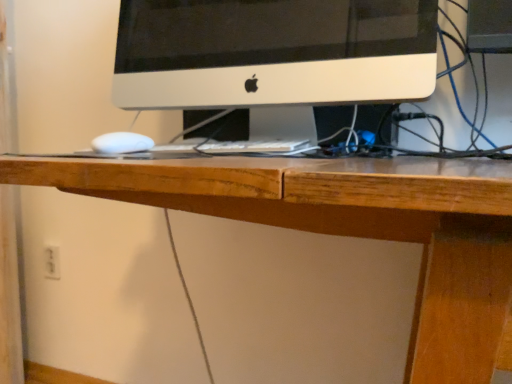
The width and height of the screenshot is (512, 384). In order to click on white plastic electric outlet at lower left in this screenshot , I will do `click(51, 262)`.

Describe the element at coordinates (51, 262) in the screenshot. The width and height of the screenshot is (512, 384). I see `white plastic electric outlet at lower left` at that location.

What are the coordinates of `white matte computer monitor at center` in the screenshot? It's located at (273, 53).

This screenshot has width=512, height=384. What do you see at coordinates (273, 53) in the screenshot?
I see `white matte computer monitor at center` at bounding box center [273, 53].

Identify the location of white plastic electric outlet at lower left. The width and height of the screenshot is (512, 384). point(51,262).

Does white plastic electric outlet at lower left appear on the right side of white matte computer monitor at center?

In fact, white plastic electric outlet at lower left is to the left of white matte computer monitor at center.

Which object is more forward, white plastic electric outlet at lower left or white matte computer monitor at center?

white matte computer monitor at center is in front.

Is point (53, 256) more distant than point (311, 93)?

Yes, point (53, 256) is farther from viewer.

From the image's perspective, is white plastic electric outlet at lower left beneath white matte computer monitor at center?

Correct, white plastic electric outlet at lower left appears lower than white matte computer monitor at center in the image.

From a real-world perspective, is white plastic electric outlet at lower left positioned over white matte computer monitor at center based on gravity?

Actually, white plastic electric outlet at lower left is physically below white matte computer monitor at center in the real world.

Is white plastic electric outlet at lower left wider than white matte computer monitor at center?

In fact, white plastic electric outlet at lower left might be narrower than white matte computer monitor at center.

Is white plastic electric outlet at lower left taller than white matte computer monitor at center?

Incorrect, the height of white plastic electric outlet at lower left is not larger of that of white matte computer monitor at center.

Between white plastic electric outlet at lower left and white matte computer monitor at center, which one has smaller size?

white plastic electric outlet at lower left.

Could white matte computer monitor at center be considered to be inside white plastic electric outlet at lower left?

No.

Is the surface of white plastic electric outlet at lower left in direct contact with white matte computer monitor at center?

They are not placed beside each other.

Is white plastic electric outlet at lower left facing away from white matte computer monitor at center?

white plastic electric outlet at lower left does not have its back to white matte computer monitor at center.

Could you measure the distance between white plastic electric outlet at lower left and white matte computer monitor at center?

white plastic electric outlet at lower left is 98.62 centimeters from white matte computer monitor at center.

You are a GUI agent. You are given a task and a screenshot of the screen. Output one action in this format:
    pyautogui.click(x=<x>, y=<y>)
    Task: Click on the computer monitor located on the right of white plastic electric outlet at lower left
    
    Given the screenshot: What is the action you would take?
    pyautogui.click(x=273, y=53)

Is white matte computer monitor at center at the right side of white plastic electric outlet at lower left?

Indeed, white matte computer monitor at center is positioned on the right side of white plastic electric outlet at lower left.

In the image, is white matte computer monitor at center positioned in front of or behind white plastic electric outlet at lower left?

Visually, white matte computer monitor at center is located in front of white plastic electric outlet at lower left.

Which point is more distant from viewer, (316, 3) or (53, 272)?

Positioned behind is point (53, 272).

From the image's perspective, is white matte computer monitor at center located above or below white plastic electric outlet at lower left?

Based on their image positions, white matte computer monitor at center is located above white plastic electric outlet at lower left.

From a real-world perspective, is white matte computer monitor at center located higher than white plastic electric outlet at lower left?

Yes.

Which of these two, white matte computer monitor at center or white plastic electric outlet at lower left, is thinner?

white plastic electric outlet at lower left is thinner.

From their relative heights in the image, would you say white matte computer monitor at center is taller or shorter than white plastic electric outlet at lower left?

In the image, white matte computer monitor at center appears to be taller than white plastic electric outlet at lower left.

Is white matte computer monitor at center bigger than white plastic electric outlet at lower left?

Indeed, white matte computer monitor at center has a larger size compared to white plastic electric outlet at lower left.

Would you say white plastic electric outlet at lower left is part of white matte computer monitor at center's contents?

No, white plastic electric outlet at lower left is not inside white matte computer monitor at center.

Is white matte computer monitor at center placed right next to white plastic electric outlet at lower left?

No, white matte computer monitor at center is not making contact with white plastic electric outlet at lower left.

Is white plastic electric outlet at lower left at the back of white matte computer monitor at center?

No, white matte computer monitor at center is not facing the opposite direction of white plastic electric outlet at lower left.

How distant is white matte computer monitor at center from white plastic electric outlet at lower left?

white matte computer monitor at center is 38.83 inches away from white plastic electric outlet at lower left.

This screenshot has width=512, height=384. Identify the location of electric outlet below the white matte computer monitor at center (from the image's perspective). (51, 262).

The height and width of the screenshot is (384, 512). In order to click on electric outlet behind the white matte computer monitor at center in this screenshot , I will do `click(51, 262)`.

Identify the location of electric outlet on the left side of white matte computer monitor at center. The height and width of the screenshot is (384, 512). (51, 262).